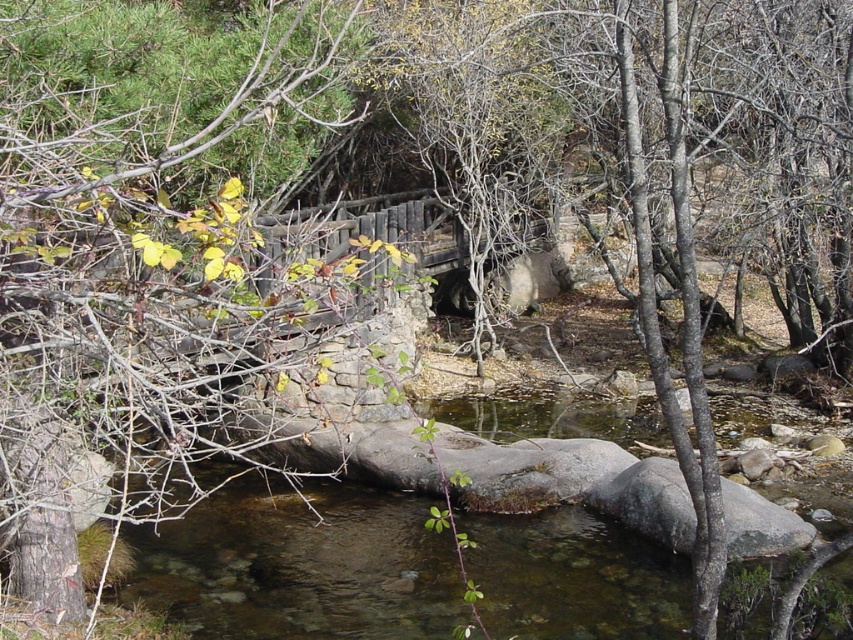
Is green leafy branches at upper left in front of clear water at center?

Yes, it is.

Who is taller, green leafy branches at upper left or clear water at center?

Standing taller between the two is green leafy branches at upper left.

Identify the location of green leafy branches at upper left. This screenshot has width=853, height=640. (135, 291).